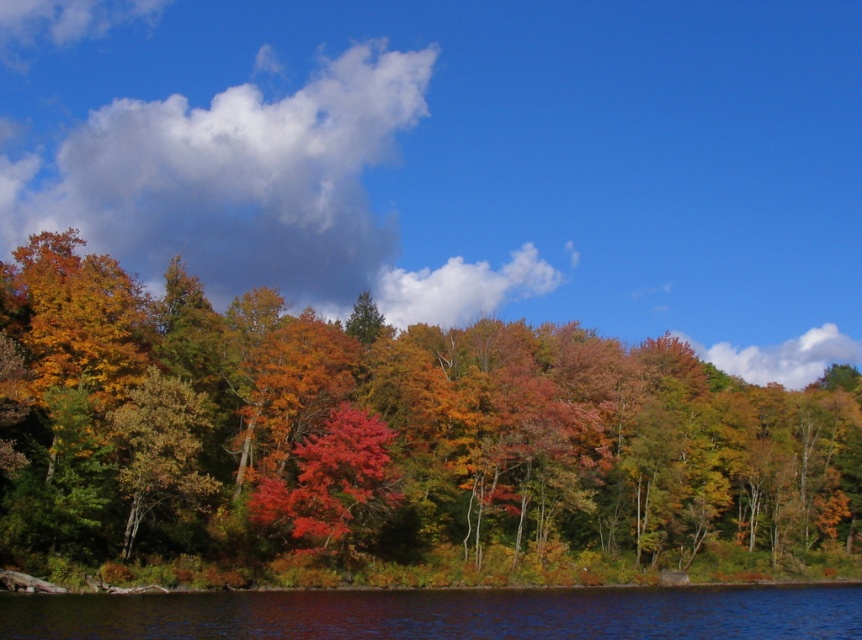
Question: Does white fluffy cloud at upper left appear on the right side of transparent blue water at lower center?

Choices:
 (A) no
 (B) yes

Answer: (A)

Question: Based on their relative distances, which object is farther from the white fluffy cloud at upper center?

Choices:
 (A) autumn leaves at center
 (B) white fluffy cloud at upper left

Answer: (A)

Question: Can you confirm if transparent blue water at lower center is positioned to the right of white fluffy cloud at upper right?

Choices:
 (A) no
 (B) yes

Answer: (A)

Question: Estimate the real-world distances between objects in this image. Which object is farther from the transparent blue water at lower center?

Choices:
 (A) bright red leaves at center
 (B) white fluffy cloud at upper right

Answer: (B)

Question: Can you confirm if autumn leaves at center is positioned to the left of white fluffy cloud at upper right?

Choices:
 (A) no
 (B) yes

Answer: (B)

Question: Among these objects, which one is farthest from the camera?

Choices:
 (A) white fluffy cloud at upper center
 (B) transparent blue water at lower center
 (C) bright red leaves at center

Answer: (A)